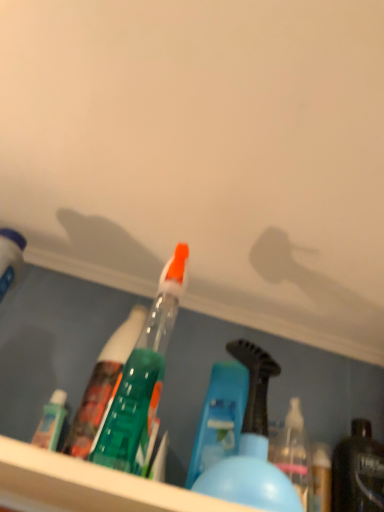
Question: Considering the relative sizes of blue plastic bottle at center, which is the second bottle in left-to-right order, and matte white bottle at left, the 1th bottle from the left, in the image provided, is blue plastic bottle at center, which is the second bottle in left-to-right order, shorter than matte white bottle at left, the 1th bottle from the left,?

Choices:
 (A) no
 (B) yes

Answer: (B)

Question: Is blue plastic bottle at center, which is the second bottle in left-to-right order, touching matte white bottle at left, the 1th bottle from the left?

Choices:
 (A) yes
 (B) no

Answer: (B)

Question: Can you confirm if blue plastic bottle at center, the 2th bottle from the right, is positioned to the left of matte white bottle at left, the 1th bottle from the left?

Choices:
 (A) no
 (B) yes

Answer: (A)

Question: From a real-world perspective, is blue plastic bottle at center, the 2th bottle from the right, under matte white bottle at left, the 1th bottle from the left?

Choices:
 (A) no
 (B) yes

Answer: (B)

Question: Is blue plastic bottle at center, the 2th bottle from the right, bigger than matte white bottle at left, the 1th bottle from the left?

Choices:
 (A) yes
 (B) no

Answer: (A)

Question: Which is correct: shiny black bottle at lower right, the 3th bottle from the left, is inside blue plastic bottle at center, the 2th bottle from the right, or outside of it?

Choices:
 (A) inside
 (B) outside

Answer: (B)

Question: Would you say shiny black bottle at lower right, the first bottle in the right-to-left sequence, is to the left or to the right of blue plastic bottle at center, which is the second bottle in left-to-right order, in the picture?

Choices:
 (A) left
 (B) right

Answer: (B)

Question: Looking at the image, does shiny black bottle at lower right, the first bottle in the right-to-left sequence, seem bigger or smaller compared to blue plastic bottle at center, the 2th bottle from the right?

Choices:
 (A) small
 (B) big

Answer: (A)

Question: In the image, is shiny black bottle at lower right, the 3th bottle from the left, positioned in front of or behind blue plastic bottle at center, which is the second bottle in left-to-right order?

Choices:
 (A) behind
 (B) front

Answer: (A)

Question: Relative to shiny black bottle at lower right, the first bottle in the right-to-left sequence, is matte white bottle at left, positioned as the 3th bottle in right-to-left order, in front or behind?

Choices:
 (A) behind
 (B) front

Answer: (B)

Question: In terms of height, does matte white bottle at left, the 1th bottle from the left, look taller or shorter compared to shiny black bottle at lower right, the 3th bottle from the left?

Choices:
 (A) short
 (B) tall

Answer: (B)

Question: Would you say matte white bottle at left, positioned as the 3th bottle in right-to-left order, is to the left or to the right of shiny black bottle at lower right, the first bottle in the right-to-left sequence, in the picture?

Choices:
 (A) right
 (B) left

Answer: (B)

Question: From a real-world perspective, relative to shiny black bottle at lower right, the 3th bottle from the left, is matte white bottle at left, positioned as the 3th bottle in right-to-left order, vertically above or below?

Choices:
 (A) below
 (B) above

Answer: (B)

Question: In terms of size, does blue plastic bottle at center, the 2th bottle from the right, appear bigger or smaller than shiny black bottle at lower right, the first bottle in the right-to-left sequence?

Choices:
 (A) big
 (B) small

Answer: (A)

Question: Visually, is blue plastic bottle at center, which is the second bottle in left-to-right order, positioned to the left or to the right of shiny black bottle at lower right, the first bottle in the right-to-left sequence?

Choices:
 (A) right
 (B) left

Answer: (B)